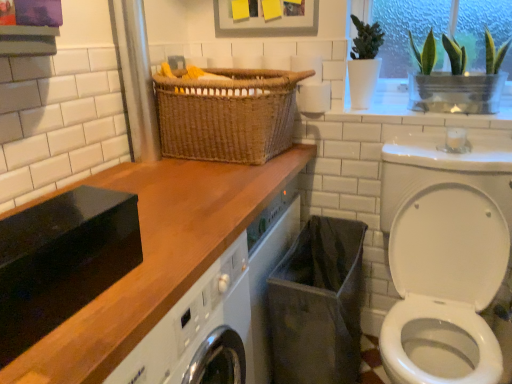
Question: Does green glass vase at upper right lie in front of black fabric laundry basket at lower center?

Choices:
 (A) yes
 (B) no

Answer: (B)

Question: Does green glass vase at upper right appear on the left side of black fabric laundry basket at lower center?

Choices:
 (A) no
 (B) yes

Answer: (A)

Question: Does green glass vase at upper right have a greater width compared to black fabric laundry basket at lower center?

Choices:
 (A) no
 (B) yes

Answer: (A)

Question: Is green glass vase at upper right beside black fabric laundry basket at lower center?

Choices:
 (A) yes
 (B) no

Answer: (B)

Question: Can you confirm if green glass vase at upper right is shorter than black fabric laundry basket at lower center?

Choices:
 (A) yes
 (B) no

Answer: (A)

Question: Can you confirm if green glass vase at upper right is thinner than black fabric laundry basket at lower center?

Choices:
 (A) yes
 (B) no

Answer: (A)

Question: Does green glass vase at upper right have a smaller size compared to woven brown basket at center?

Choices:
 (A) yes
 (B) no

Answer: (A)

Question: Does green glass vase at upper right have a lesser height compared to woven brown basket at center?

Choices:
 (A) no
 (B) yes

Answer: (B)

Question: Is green glass vase at upper right to the right of woven brown basket at center from the viewer's perspective?

Choices:
 (A) yes
 (B) no

Answer: (A)

Question: Considering the relative sizes of green glass vase at upper right and woven brown basket at center in the image provided, is green glass vase at upper right wider than woven brown basket at center?

Choices:
 (A) no
 (B) yes

Answer: (A)

Question: Can you confirm if green glass vase at upper right is bigger than woven brown basket at center?

Choices:
 (A) yes
 (B) no

Answer: (B)

Question: From the image's perspective, does green glass vase at upper right appear lower than woven brown basket at center?

Choices:
 (A) no
 (B) yes

Answer: (A)

Question: Considering the relative sizes of black fabric laundry basket at lower center and green glass vase at upper right in the image provided, is black fabric laundry basket at lower center wider than green glass vase at upper right?

Choices:
 (A) yes
 (B) no

Answer: (A)